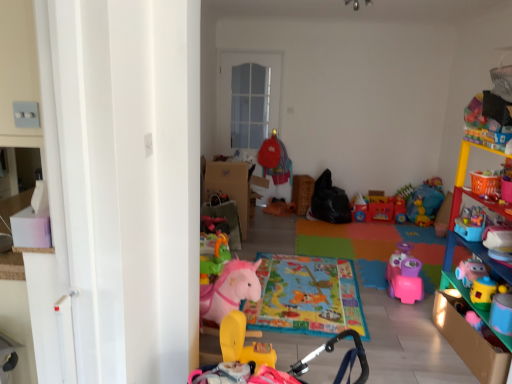
Question: In which direction should I rotate to look at rubber yellow horse at center, the 2th toy from the front?

Choices:
 (A) right
 (B) left

Answer: (B)

Question: Considering the relative sizes of rubber yellow rocking horse at lower center, the second toy from the back, and multicolored plastic shelf at right in the image provided, is rubber yellow rocking horse at lower center, the second toy from the back, bigger than multicolored plastic shelf at right?

Choices:
 (A) no
 (B) yes

Answer: (A)

Question: From a real-world perspective, is rubber yellow rocking horse at lower center, the second toy from the back, beneath multicolored plastic shelf at right?

Choices:
 (A) no
 (B) yes

Answer: (B)

Question: Does rubber yellow rocking horse at lower center, the second toy from the back, touch multicolored plastic shelf at right?

Choices:
 (A) no
 (B) yes

Answer: (A)

Question: From a real-world perspective, is rubber yellow rocking horse at lower center, the 1th toy positioned from the front, on top of multicolored plastic shelf at right?

Choices:
 (A) yes
 (B) no

Answer: (B)

Question: Is rubber yellow rocking horse at lower center, the 1th toy positioned from the front, at the left side of multicolored plastic shelf at right?

Choices:
 (A) no
 (B) yes

Answer: (B)

Question: Considering the relative sizes of rubber yellow rocking horse at lower center, the second toy from the back, and multicolored plastic shelf at right in the image provided, is rubber yellow rocking horse at lower center, the second toy from the back, shorter than multicolored plastic shelf at right?

Choices:
 (A) yes
 (B) no

Answer: (A)

Question: Does multicolored plastic shelf at right have a smaller size compared to rubber yellow horse at center, the 2th toy from the front?

Choices:
 (A) no
 (B) yes

Answer: (A)

Question: Is there a large distance between multicolored plastic shelf at right and rubber yellow horse at center, acting as the first toy starting from the back?

Choices:
 (A) yes
 (B) no

Answer: (A)

Question: Is multicolored plastic shelf at right touching rubber yellow horse at center, the 2th toy from the front?

Choices:
 (A) no
 (B) yes

Answer: (A)

Question: Considering the relative positions of multicolored plastic shelf at right and rubber yellow horse at center, acting as the first toy starting from the back, in the image provided, is multicolored plastic shelf at right to the left of rubber yellow horse at center, acting as the first toy starting from the back, from the viewer's perspective?

Choices:
 (A) no
 (B) yes

Answer: (A)

Question: Is multicolored plastic shelf at right bigger than rubber yellow horse at center, the 2th toy from the front?

Choices:
 (A) no
 (B) yes

Answer: (B)

Question: From a real-world perspective, is multicolored plastic shelf at right under rubber yellow horse at center, acting as the first toy starting from the back?

Choices:
 (A) yes
 (B) no

Answer: (B)

Question: Is rubber yellow horse at center, acting as the first toy starting from the back, completely or partially outside of rubber yellow rocking horse at lower center, the 1th toy positioned from the front?

Choices:
 (A) no
 (B) yes

Answer: (B)